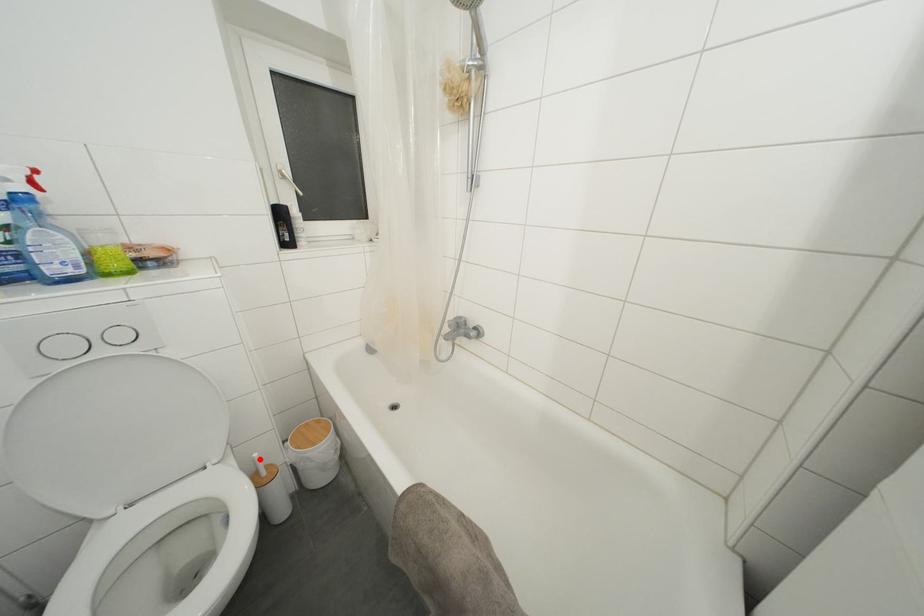
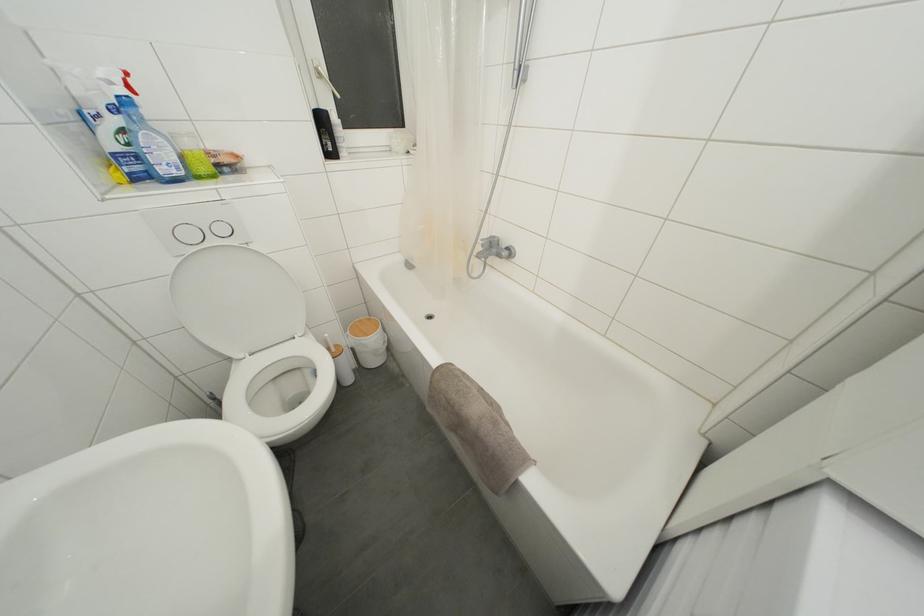
In the second image, find the point that corresponds to the highlighted location in the first image.

(331, 339)